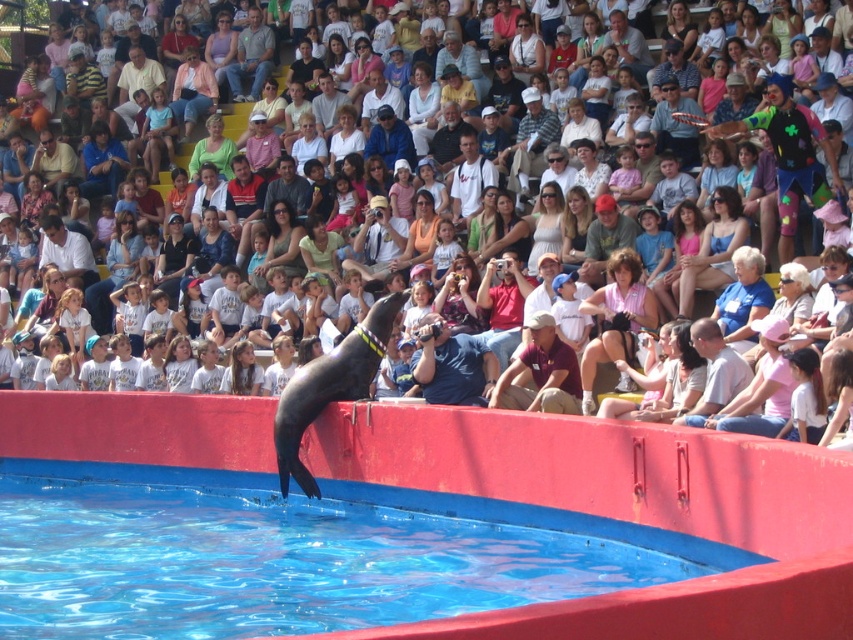
Is the position of blue shirt at center less distant than that of matte black seal at center?

Yes, it is.

Is blue shirt at center thinner than matte black seal at center?

Correct, blue shirt at center's width is less than matte black seal at center's.

You are a GUI agent. You are given a task and a screenshot of the screen. Output one action in this format:
    pyautogui.click(x=<x>, y=<y>)
    Task: Click on the blue shirt at center
    This screenshot has height=640, width=853.
    Given the screenshot: What is the action you would take?
    pyautogui.click(x=453, y=365)

Locate an element on the screen. The image size is (853, 640). blue shirt at center is located at coordinates (453, 365).

Does blue smooth water at center come behind blue shirt at center?

No, blue smooth water at center is closer to the viewer.

Based on the photo, is blue smooth water at center above blue shirt at center?

No.

Describe the element at coordinates (294, 554) in the screenshot. I see `blue smooth water at center` at that location.

Locate an element on the screen. The height and width of the screenshot is (640, 853). blue smooth water at center is located at coordinates (294, 554).

Can you confirm if blue smooth water at center is wider than matte black seal at center?

No.

Which is above, blue smooth water at center or matte black seal at center?

matte black seal at center is higher up.

At what (x,y) coordinates should I click in order to perform the action: click on blue smooth water at center. Please return your answer as a coordinate pair (x, y). The height and width of the screenshot is (640, 853). Looking at the image, I should click on (294, 554).